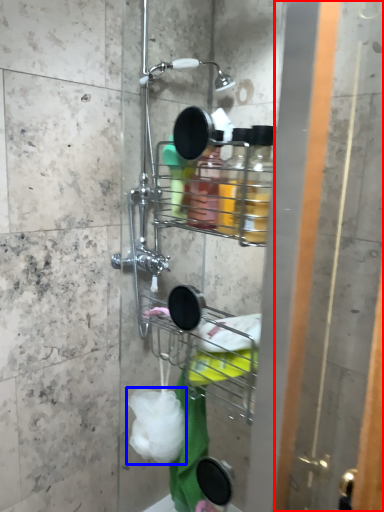
Question: Which object appears farthest to the camera in this image, screen door (highlighted by a red box) or plastic (highlighted by a blue box)?

Choices:
 (A) screen door
 (B) plastic

Answer: (B)